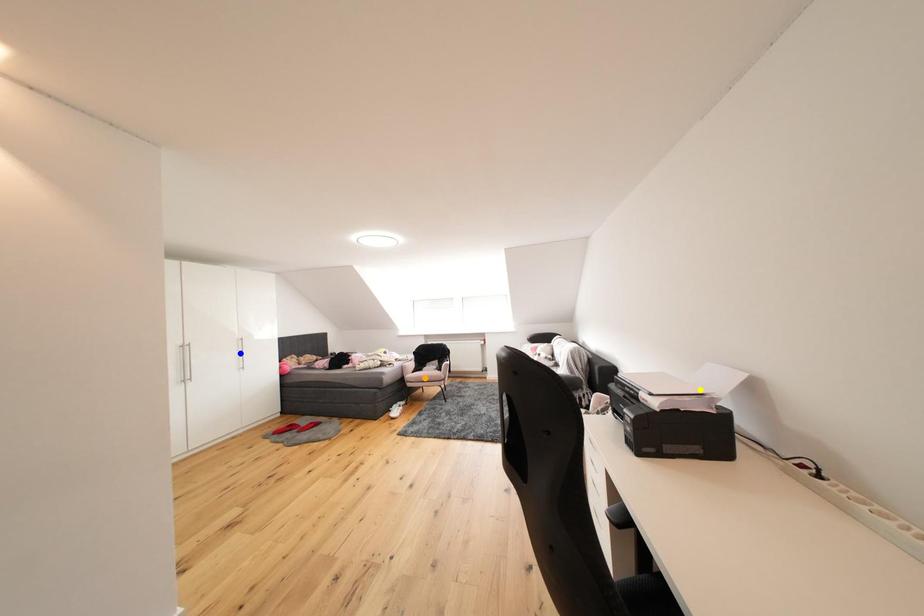
Order these from nearest to farthest:
yellow point, orange point, blue point

1. yellow point
2. orange point
3. blue point